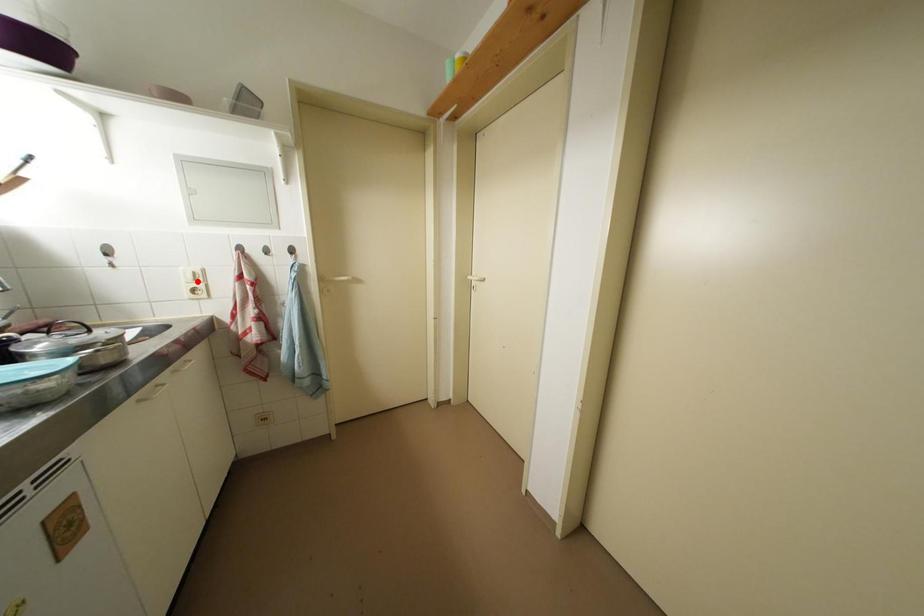
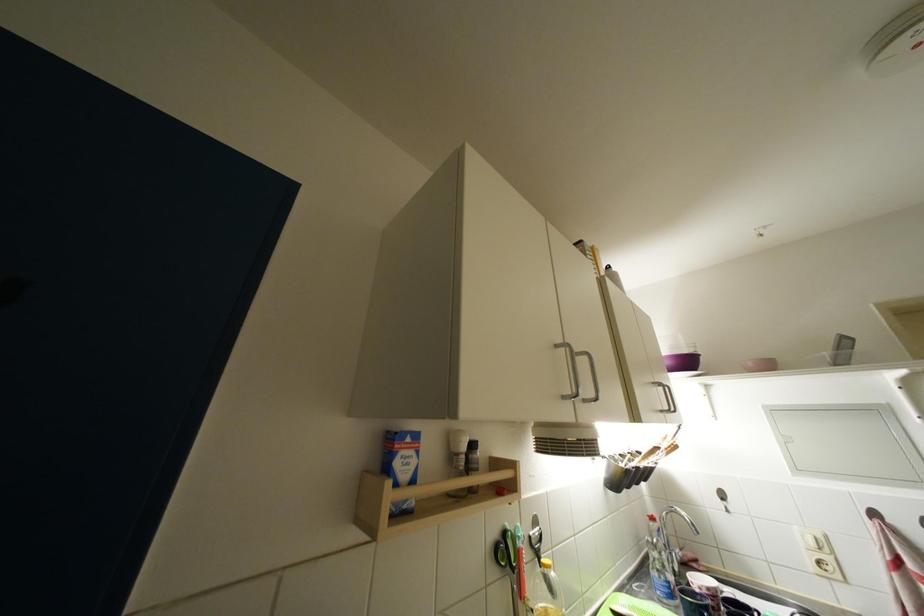
Where in the second image is the point corresponding to the highlighted location from the first image?

(820, 548)